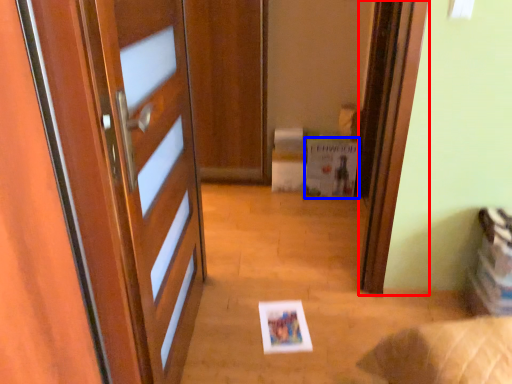
Question: Which object appears closest to the camera in this image, screen door (highlighted by a red box) or postcard (highlighted by a blue box)?

Choices:
 (A) screen door
 (B) postcard

Answer: (A)